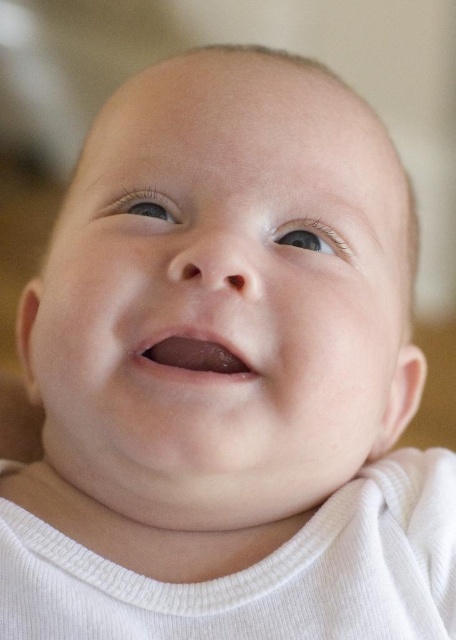
Based on the scene, which object has a greater width between the smooth pink lips at center and the blue smooth eye at upper center?

The smooth pink lips at center have a greater width than the blue smooth eye at upper center.